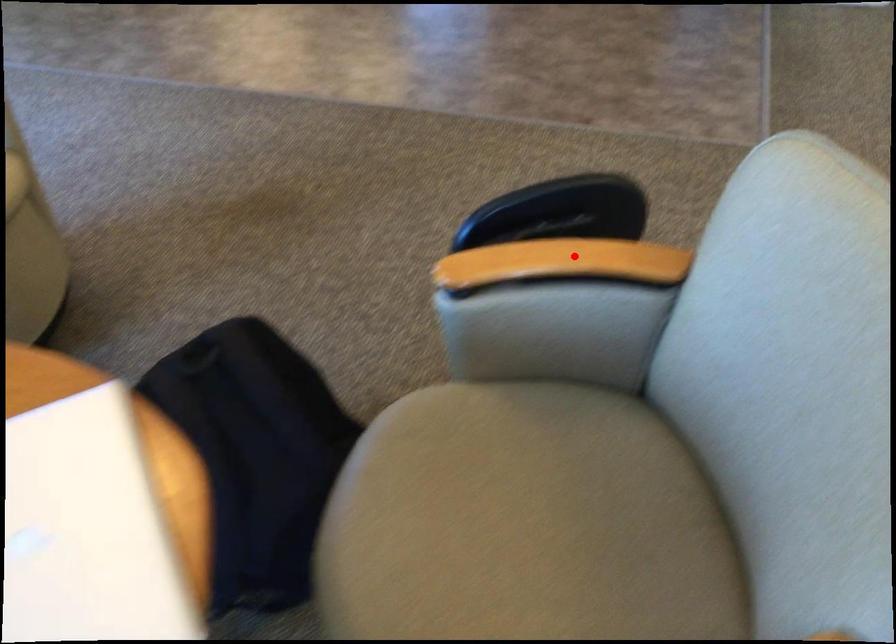
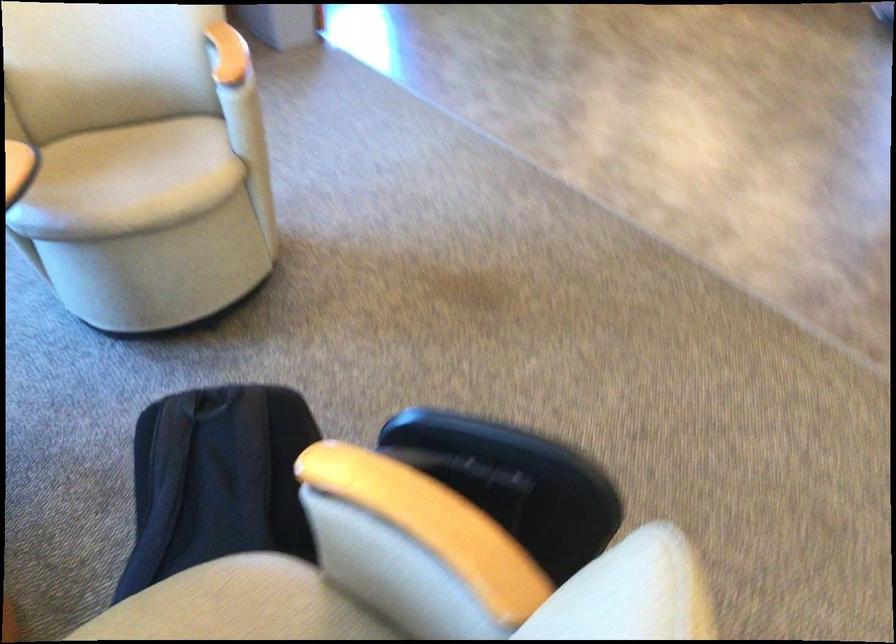
The point at the highlighted location is marked in the first image. Where is the corresponding point in the second image?

(431, 525)